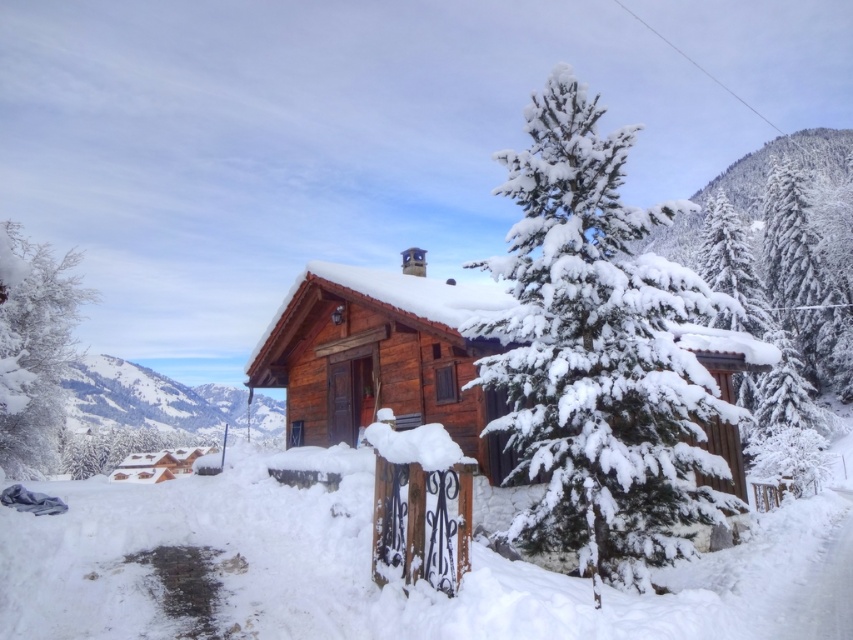
You are standing at the point with coordinates point (831, 333) and want to walk towards the cabin. Will you pass by point (108, 365) on your way?

Yes, because point (831, 333) is in front of point (108, 365), so walking towards the cabin from point (831, 333) would require passing through point (108, 365).